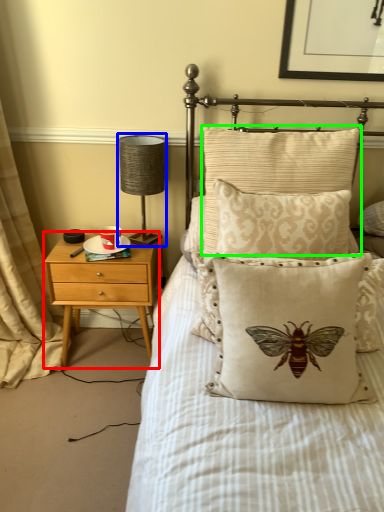
Question: Which is farther away from nightstand (highlighted by a red box)? table lamp (highlighted by a blue box) or pillow (highlighted by a green box)?

Choices:
 (A) table lamp
 (B) pillow

Answer: (B)